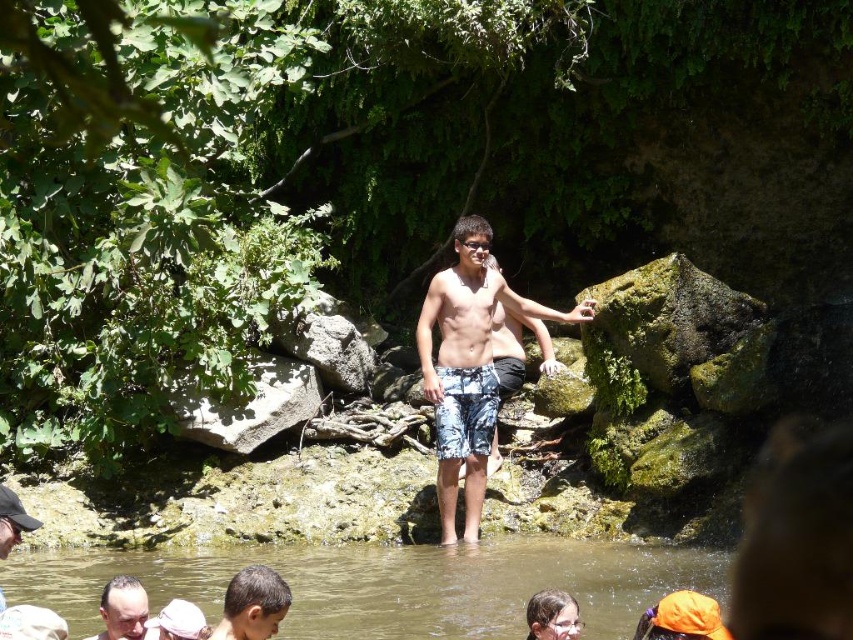
You are a photographer trying to capture the scene by the river. You notice the camouflage shorts at center and the dark brown hair at lower left. Which object is wider in the image?

The camouflage shorts at center is wider than the dark brown hair at lower left.

You are a photographer standing at the edge of the river. You want to take a photo that includes both the point at position (471, 580) and the point at position (468, 288). Which point will appear larger in your photo?

Point at position (471, 580) will appear larger in the photo because it is closer to the camera than point at position (468, 288).

You are a photographer standing in the scene and want to capture both the smooth brown hair at lower center and the dark brown hair at lower left in the same frame. Given that your camera has a maximum focal length allowing a 10 feet range, will you be able to include both subjects in your photo?

The distance between the smooth brown hair at lower center and the dark brown hair at lower left is 8.50 feet, which is within the camera maximum focal length of 10 feet. Therefore, you can capture both subjects in the same frame.